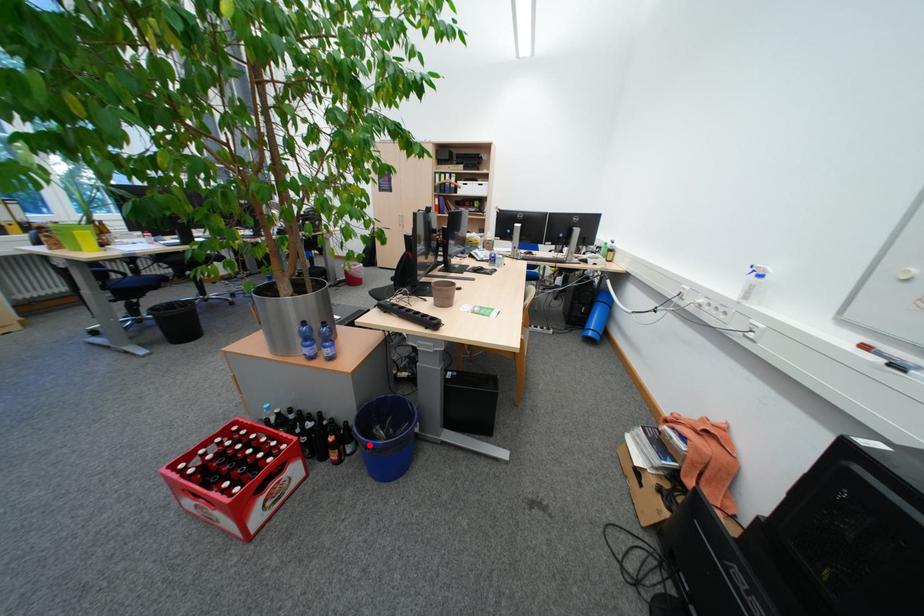
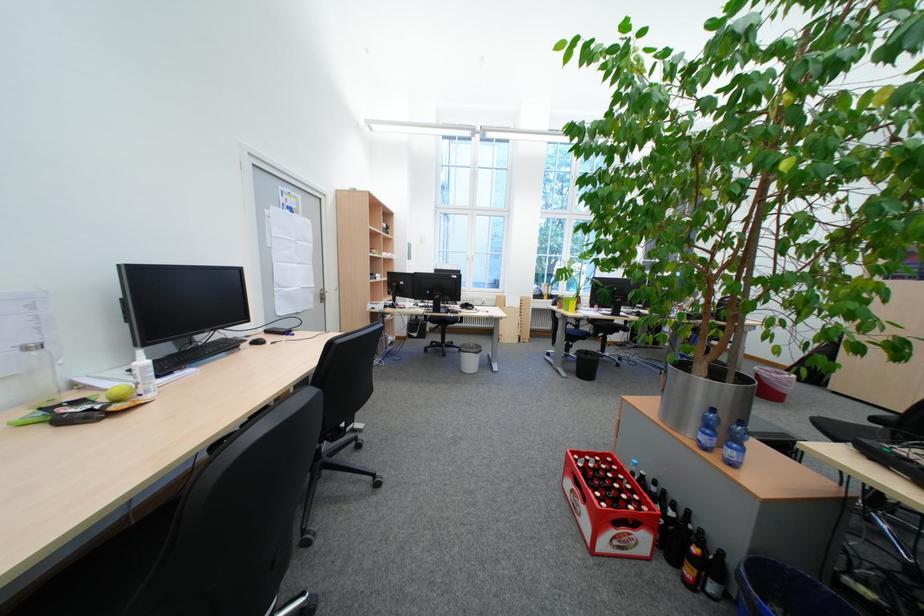
In the second image, find the point that corresponds to the highlighted location in the first image.

(738, 597)